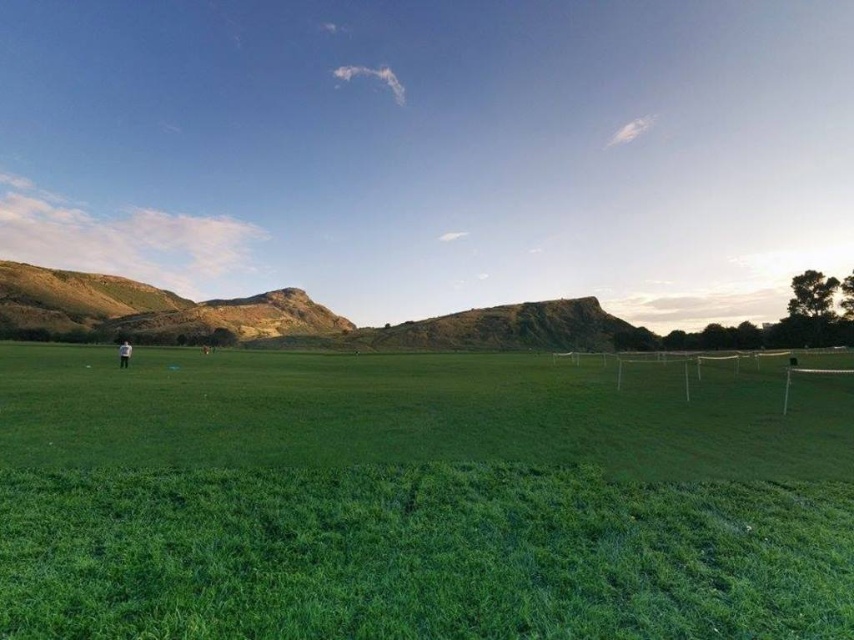
Question: Can you confirm if green grass at center is smaller than white fabric person at left?

Choices:
 (A) yes
 (B) no

Answer: (A)

Question: Which object appears farthest from the camera in this image?

Choices:
 (A) green grass at center
 (B) white fabric person at left

Answer: (B)

Question: Which object is closer to the camera taking this photo?

Choices:
 (A) green grass at center
 (B) white fabric person at left

Answer: (A)

Question: Can you confirm if green grass at center is bigger than white fabric person at left?

Choices:
 (A) yes
 (B) no

Answer: (B)

Question: Can you confirm if green grass at center is smaller than white fabric person at left?

Choices:
 (A) no
 (B) yes

Answer: (B)